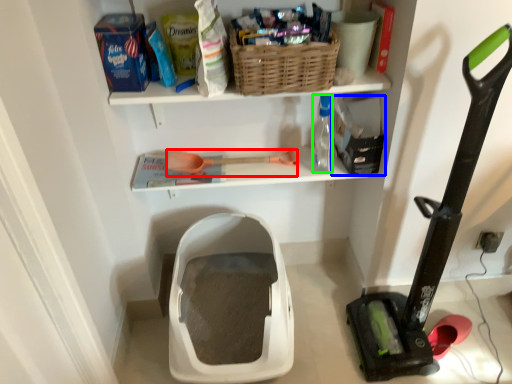
Question: Which object is the closest to the tool (highlighted by a red box)? Choose among these: storage box (highlighted by a blue box) or bottle (highlighted by a green box).

Choices:
 (A) storage box
 (B) bottle

Answer: (B)